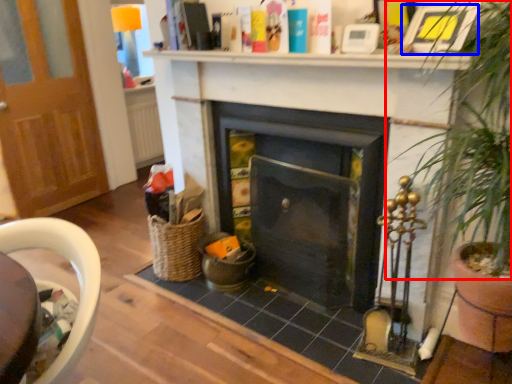
Question: Which point is further to the camera, plant (highlighted by a red box) or picture frame (highlighted by a blue box)?

Choices:
 (A) plant
 (B) picture frame

Answer: (B)